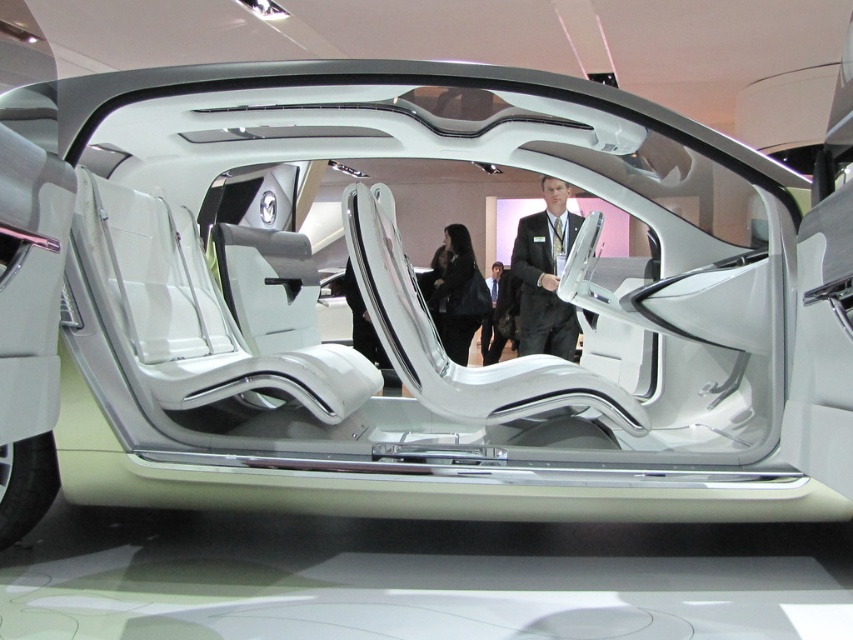
Is black suit at center further to the viewer compared to dark suit at center?

No, it is in front of dark suit at center.

Consider the image. Who is taller, black suit at center or dark suit at center?

black suit at center is taller.

Between point (512, 269) and point (494, 308), which one is positioned behind?

Point (494, 308)

At what (x,y) coordinates should I click in order to perform the action: click on black suit at center. Please return your answer as a coordinate pair (x, y). Looking at the image, I should click on (544, 275).